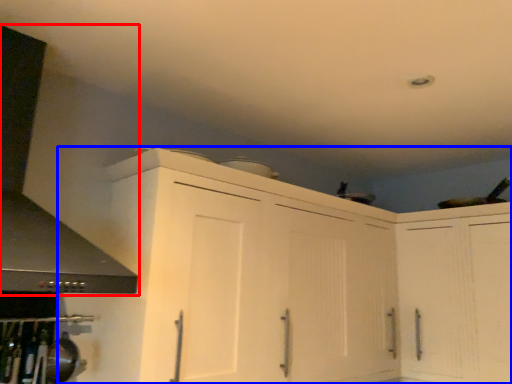
Question: Which object appears farthest to the camera in this image, exhaust hood (highlighted by a red box) or cabinetry (highlighted by a blue box)?

Choices:
 (A) exhaust hood
 (B) cabinetry

Answer: (B)